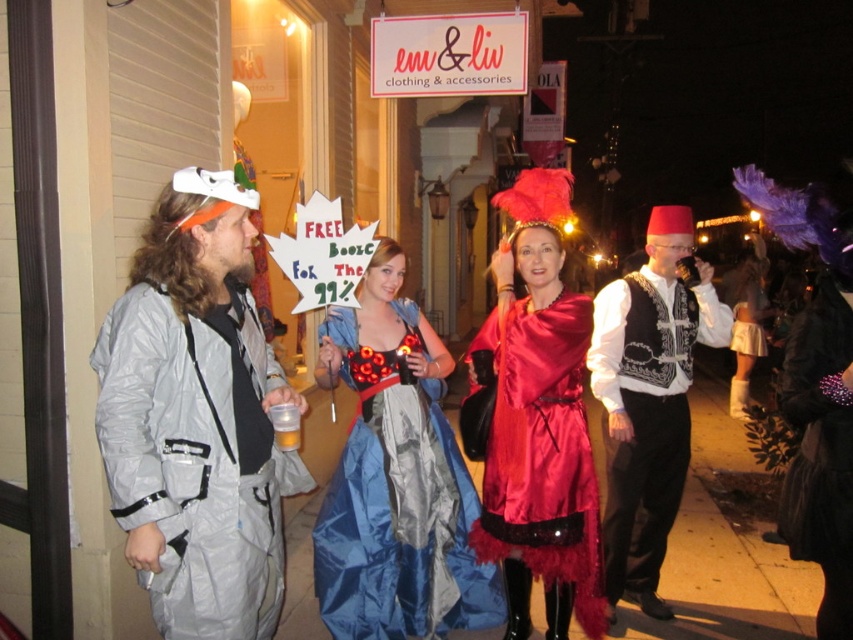
You are a photographer trying to capture both the silver metallic jumpsuit at left and the black furry coat at right in a single frame. The camera you have can only focus on subjects within a 1.5 meter range. Will you be able to include both in the photo without moving the camera?

The silver metallic jumpsuit at left and the black furry coat at right are 1.86 meters apart, which exceeds the camera focus range of 1.5 meters. Therefore, you cannot include both in the photo without moving the camera.

You are a photographer standing at the center of the street. You want to take a photo that includes both the black furry coat at right and the translucent plastic cup at lower left. What is the minimum distance you need to move to ensure both are in frame?

The minimum distance you need to move is 5.61 feet, which is the distance between the black furry coat at right and the translucent plastic cup at lower left.

You are a photographer trying to capture a group photo of the blue satin dress at center and the white embroidered vest at center. Since you want to ensure both are fully visible, which of the two requires more space in the frame horizontally?

The white embroidered vest at center requires more space in the frame horizontally because its width is greater than the blue satin dress at center.